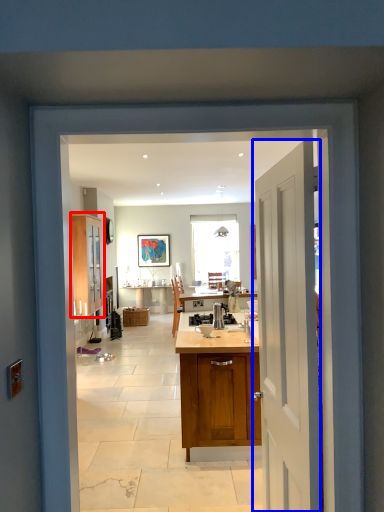
Question: Which object is closer to the camera taking this photo, cabinetry (highlighted by a red box) or door (highlighted by a blue box)?

Choices:
 (A) cabinetry
 (B) door

Answer: (B)